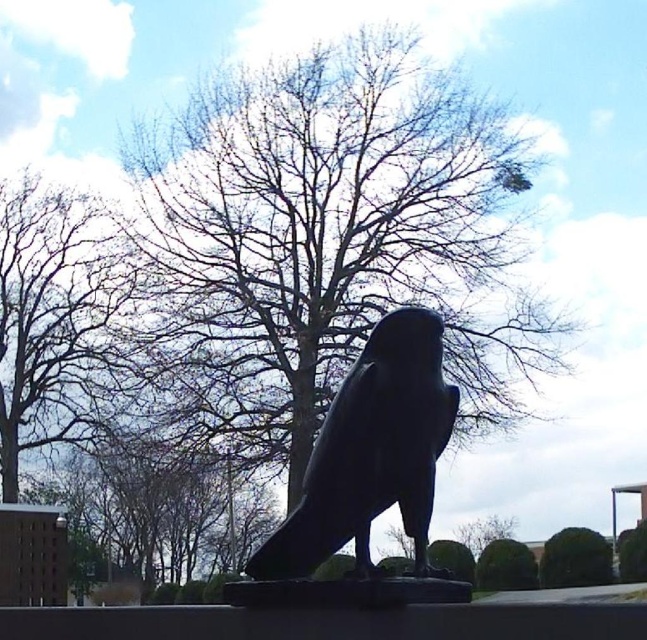
Question: Can you confirm if shiny black bird at center is positioned below green leafy bush at lower center?

Choices:
 (A) no
 (B) yes

Answer: (A)

Question: Which object is the farthest from the green leafy bush at lower center?

Choices:
 (A) bare branches at center
 (B) shiny black bird at center

Answer: (B)

Question: Among these objects, which one is farthest from the camera?

Choices:
 (A) bare branches at upper left
 (B) shiny black bird at center
 (C) green leafy bush at lower center
 (D) bare branches at center

Answer: (A)

Question: Which point is closer to the camera taking this photo?

Choices:
 (A) (300, 392)
 (B) (384, 413)
 (C) (556, 547)

Answer: (B)

Question: Does bare branches at upper left appear on the left side of green leafy bush at lower center?

Choices:
 (A) no
 (B) yes

Answer: (B)

Question: Does bare branches at upper left lie behind green leafy bush at lower center?

Choices:
 (A) yes
 (B) no

Answer: (A)